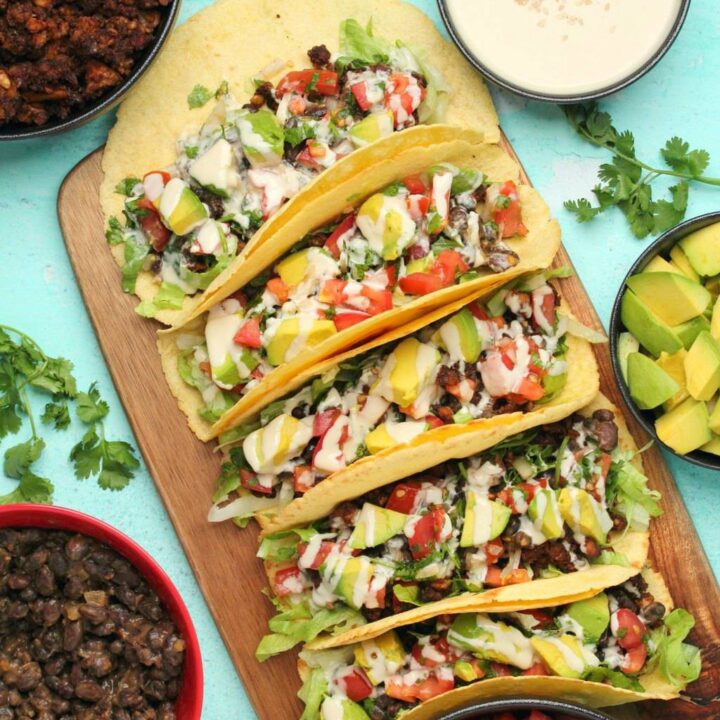
Find the location of a particular element. tabletop is located at coordinates (36, 264).